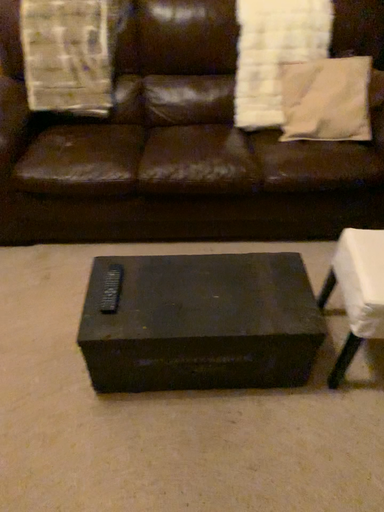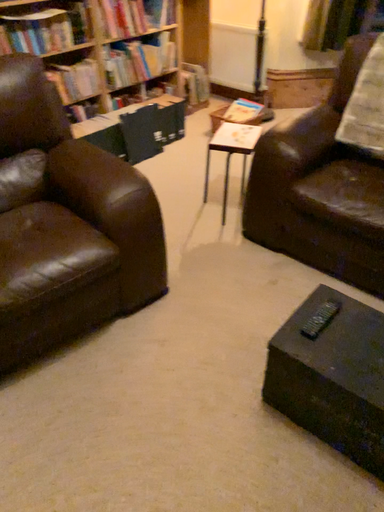
Question: Which way did the camera rotate in the video?

Choices:
 (A) rotated left
 (B) rotated right

Answer: (A)